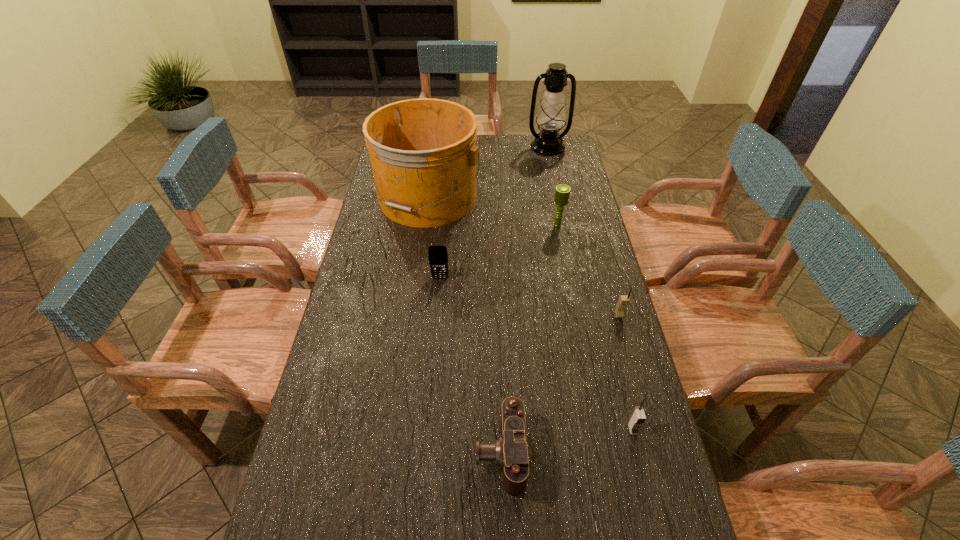
Identify the location of free region located on the right of the bucket. (553, 198).

The height and width of the screenshot is (540, 960). I want to click on vacant area located 0.130m on the front of the microphone, so click(564, 253).

The image size is (960, 540). In order to click on blank area located on the screen of the fourth farthest object in this screenshot , I will do `click(434, 345)`.

Locate an element on the screen. The height and width of the screenshot is (540, 960). vacant space located 0.140m on the front-facing side of the nearest cellular telephone is located at coordinates (649, 495).

You are a GUI agent. You are given a task and a screenshot of the screen. Output one action in this format:
    pyautogui.click(x=<x>, y=<y>)
    Task: Click on the free spot located on the front of the fifth farthest object, where the keypad is located
    
    Given the screenshot: What is the action you would take?
    pyautogui.click(x=638, y=385)

You are a GUI agent. You are given a task and a screenshot of the screen. Output one action in this format:
    pyautogui.click(x=<x>, y=<y>)
    Task: Click on the blank space located on the front-facing side of the seventh tallest object
    The width and height of the screenshot is (960, 540).
    Given the screenshot: What is the action you would take?
    pyautogui.click(x=381, y=453)

You are a GUI agent. You are given a task and a screenshot of the screen. Output one action in this format:
    pyautogui.click(x=<x>, y=<y>)
    Task: Click on the vacant area situated on the front-facing side of the seventh tallest object
    The image size is (960, 540).
    Given the screenshot: What is the action you would take?
    pyautogui.click(x=352, y=453)

Image resolution: width=960 pixels, height=540 pixels. I want to click on vacant space situated 0.140m on the front-facing side of the seventh tallest object, so click(x=419, y=453).

The height and width of the screenshot is (540, 960). I want to click on object that is at the far edge, so click(x=551, y=117).

Identify the location of object that is positioned at the left edge. The width and height of the screenshot is (960, 540). [x=423, y=153].